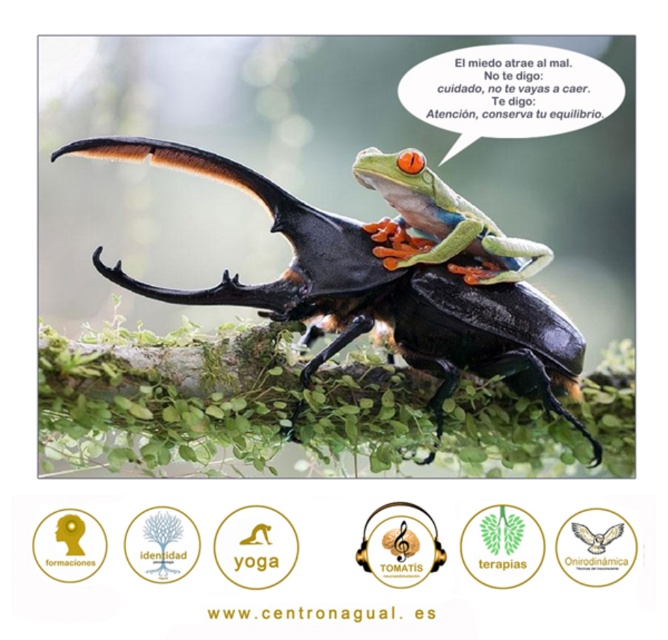
Who is more forward, (426, 332) or (415, 154)?

Point (415, 154) is more forward.

Which is below, shiny black beetle at center or shiny green frog at center?

shiny black beetle at center is below.

The width and height of the screenshot is (668, 640). What do you see at coordinates (375, 292) in the screenshot? I see `shiny black beetle at center` at bounding box center [375, 292].

Locate an element on the screen. Image resolution: width=668 pixels, height=640 pixels. shiny black beetle at center is located at coordinates (375, 292).